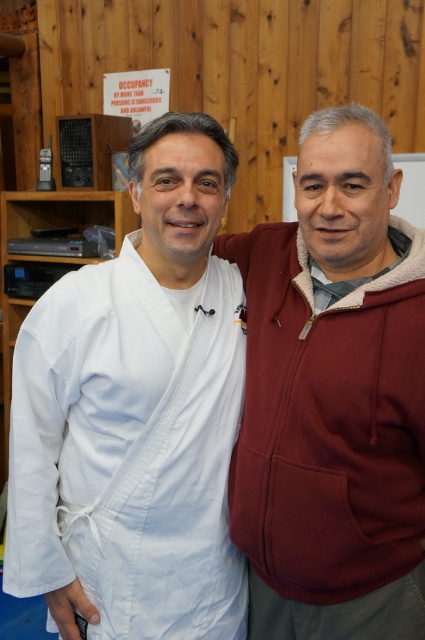
Who is higher up, maroon fleece jacket at right or matte wood bulletin board at upper center?

matte wood bulletin board at upper center is higher up.

Measure the distance between maroon fleece jacket at right and camera.

maroon fleece jacket at right is 1.02 meters from camera.

At what (x,y) coordinates should I click in order to perform the action: click on maroon fleece jacket at right. Please return your answer as a coordinate pair (x, y). This screenshot has height=640, width=425. Looking at the image, I should click on (333, 397).

Looking at this image, can you confirm if maroon fleece jacket at right is bigger than white cotton lab coat at left?

Yes, maroon fleece jacket at right is bigger than white cotton lab coat at left.

Which is behind, point (229, 529) or point (240, 376)?

Positioned behind is point (240, 376).

Which is behind, point (371, 230) or point (149, 554)?

Point (149, 554)

Locate an element on the screen. The image size is (425, 640). maroon fleece jacket at right is located at coordinates pyautogui.click(x=333, y=397).

Is white cotton lab coat at left bigger than matte wood bulletin board at upper center?

Indeed, white cotton lab coat at left has a larger size compared to matte wood bulletin board at upper center.

Which is below, white cotton lab coat at left or matte wood bulletin board at upper center?

Positioned lower is white cotton lab coat at left.

The height and width of the screenshot is (640, 425). Describe the element at coordinates (129, 451) in the screenshot. I see `white cotton lab coat at left` at that location.

Where is `white cotton lab coat at left`? The width and height of the screenshot is (425, 640). white cotton lab coat at left is located at coordinates 129,451.